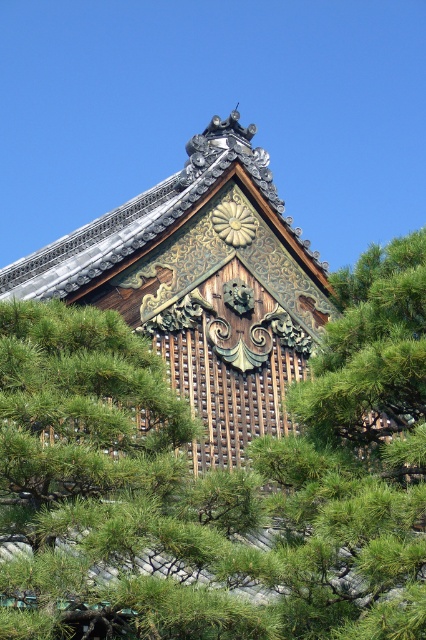
Between green textured pine tree at center and gold/ornate wood at upper center, which one has less height?

With less height is green textured pine tree at center.

Is point (414, 346) positioned after point (173, 189)?

No, (414, 346) is closer to viewer.

You are a GUI agent. You are given a task and a screenshot of the screen. Output one action in this format:
    pyautogui.click(x=<x>, y=<y>)
    Task: Click on the green textured pine tree at center
    
    Given the screenshot: What is the action you would take?
    pyautogui.click(x=218, y=477)